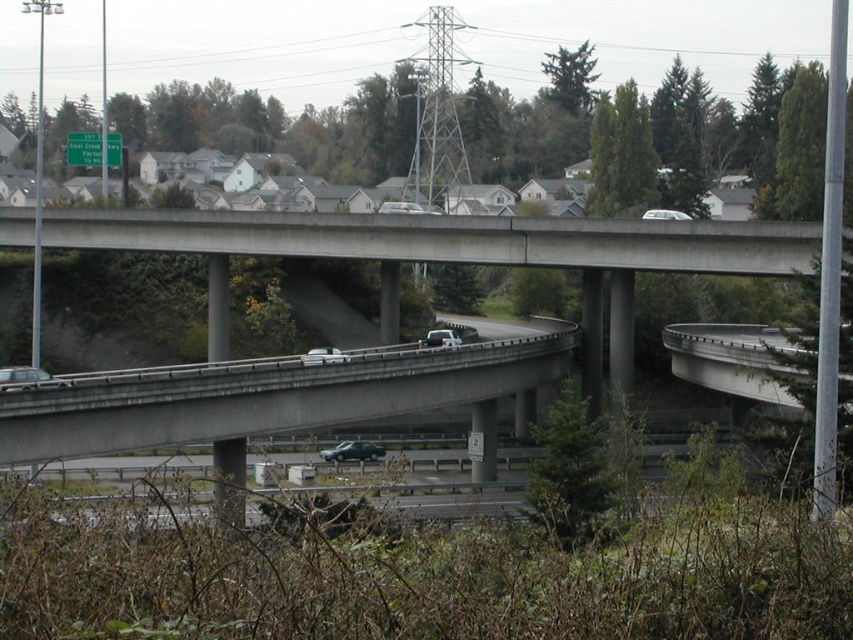
Question: Is metallic silver sedan at center in front of white matte sedan at center?

Choices:
 (A) no
 (B) yes

Answer: (A)

Question: Among these objects, which one is nearest to the camera?

Choices:
 (A) white matte sedan at center
 (B) metallic silver sedan at center
 (C) metallic green sedan at center

Answer: (A)

Question: Which point is closer to the camera?

Choices:
 (A) (360, 456)
 (B) (439, 342)
 (C) (32, 369)

Answer: (C)

Question: Which object appears farthest from the camera in this image?

Choices:
 (A) white matte truck at center
 (B) metallic silver sedan at center

Answer: (B)

Question: Is metallic silver sedan at center below white matte sedan at center?

Choices:
 (A) yes
 (B) no

Answer: (A)

Question: Considering the relative positions of metallic green sedan at center and metallic silver sedan at center in the image provided, where is metallic green sedan at center located with respect to metallic silver sedan at center?

Choices:
 (A) above
 (B) below

Answer: (B)